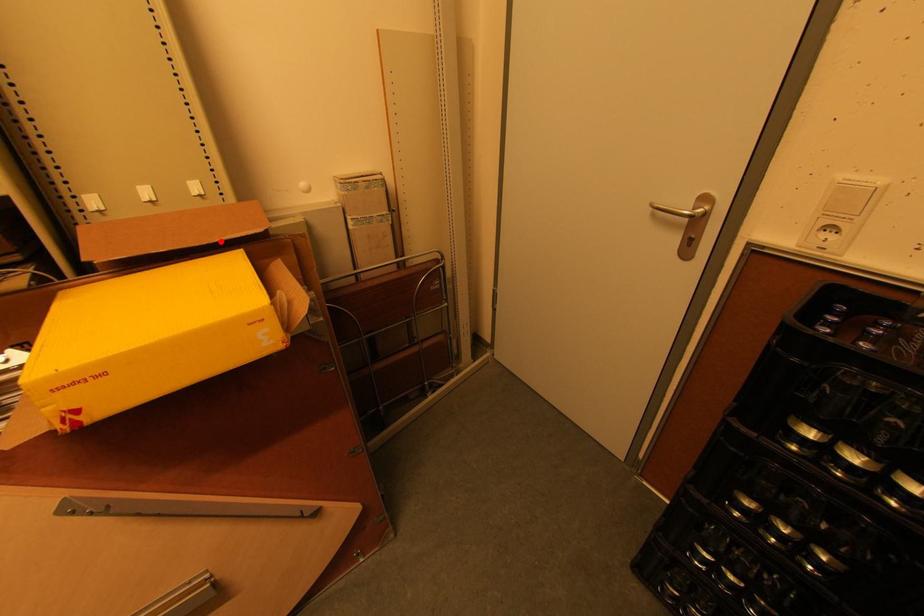
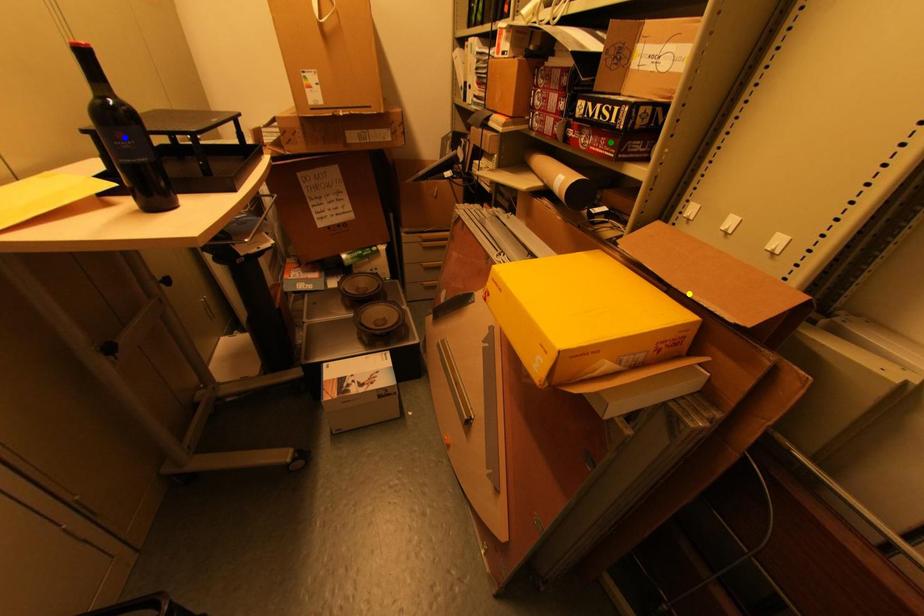
Question: I am providing you with two images of the same scene from different viewpoints. A red point is marked on the first image. You are given multiple points on the second image. Which point in image 2 is actually the same real-world point as the red point in image 1?

Choices:
 (A) yellow point
 (B) blue point
 (C) green point

Answer: (A)